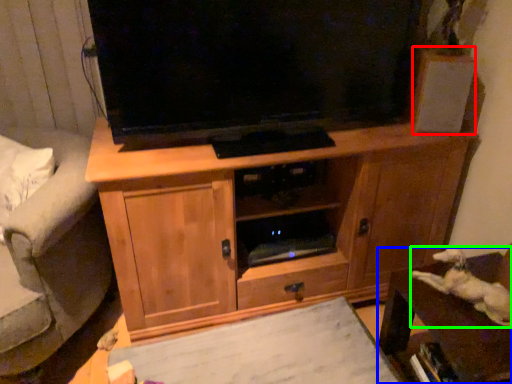
Question: Based on their relative distances, which object is nearer to speaker (highlighted by a red box)? Choose from furniture (highlighted by a blue box) and animal (highlighted by a green box).

Choices:
 (A) furniture
 (B) animal

Answer: (B)